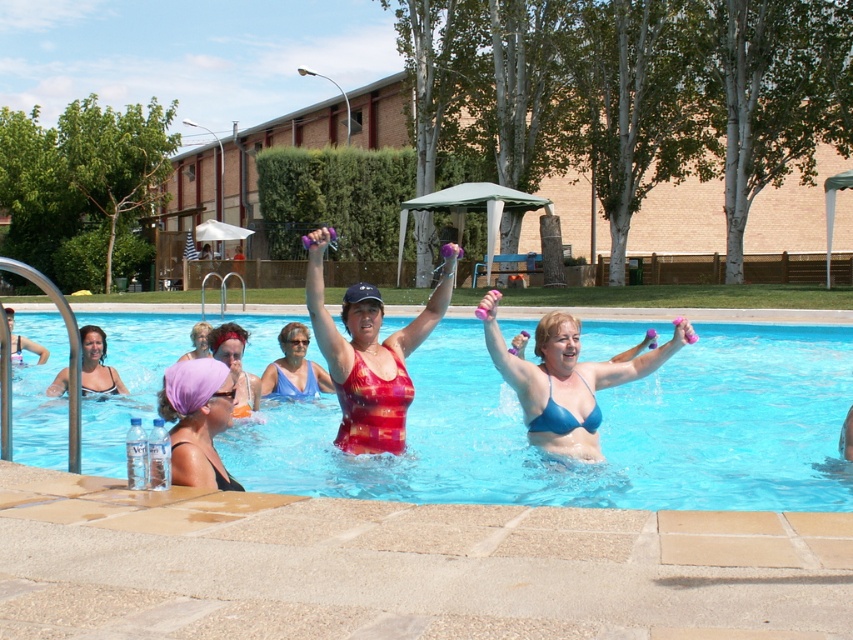
Locate an element on the screen. The height and width of the screenshot is (640, 853). blue glossy water at center is located at coordinates (598, 432).

Between blue glossy water at center and purple fabric headscarf at upper left, which one appears on the right side from the viewer's perspective?

blue glossy water at center

The width and height of the screenshot is (853, 640). What do you see at coordinates (598, 432) in the screenshot? I see `blue glossy water at center` at bounding box center [598, 432].

The height and width of the screenshot is (640, 853). Identify the location of blue glossy water at center. (598, 432).

Can you confirm if red textured swimsuit at center is bigger than matte black swimsuit at upper left?

Yes.

Is red textured swimsuit at center wider than matte black swimsuit at upper left?

Yes.

Does point (386, 387) come farther from viewer compared to point (53, 387)?

No.

You are a GUI agent. You are given a task and a screenshot of the screen. Output one action in this format:
    pyautogui.click(x=<x>, y=<y>)
    Task: Click on the red textured swimsuit at center
    Image resolution: width=853 pixels, height=640 pixels.
    Given the screenshot: What is the action you would take?
    pyautogui.click(x=369, y=353)

Does blue bikini at center appear over transparent plastic goggles at upper center?

Yes, blue bikini at center is above transparent plastic goggles at upper center.

Is the position of blue bikini at center less distant than that of transparent plastic goggles at upper center?

That is False.

Identify the location of blue bikini at center. The image size is (853, 640). (566, 378).